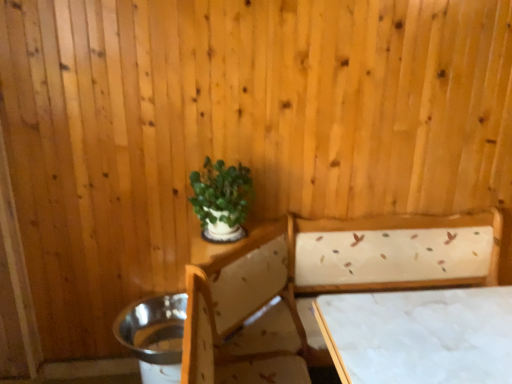
Question: Does white fabric-covered table at lower right come behind white fabric bed at center?

Choices:
 (A) yes
 (B) no

Answer: (A)

Question: From a real-world perspective, does white fabric-covered table at lower right sit lower than white fabric bed at center?

Choices:
 (A) no
 (B) yes

Answer: (A)

Question: Is white fabric-covered table at lower right completely or partially outside of white fabric bed at center?

Choices:
 (A) no
 (B) yes

Answer: (A)

Question: Considering the relative sizes of white fabric-covered table at lower right and white fabric bed at center in the image provided, is white fabric-covered table at lower right shorter than white fabric bed at center?

Choices:
 (A) no
 (B) yes

Answer: (B)

Question: Is white fabric-covered table at lower right to the right of white fabric bed at center from the viewer's perspective?

Choices:
 (A) yes
 (B) no

Answer: (A)

Question: Is white fabric-covered table at lower right in front of white fabric bed at center?

Choices:
 (A) yes
 (B) no

Answer: (B)

Question: Does white fabric bed at center appear on the right side of white fabric-covered table at lower right?

Choices:
 (A) yes
 (B) no

Answer: (B)

Question: From the image's perspective, is white fabric bed at center beneath white fabric-covered table at lower right?

Choices:
 (A) no
 (B) yes

Answer: (B)

Question: Does white fabric bed at center have a lesser width compared to white fabric-covered table at lower right?

Choices:
 (A) yes
 (B) no

Answer: (B)

Question: Does white fabric bed at center lie behind white fabric-covered table at lower right?

Choices:
 (A) yes
 (B) no

Answer: (B)

Question: From a real-world perspective, is white fabric bed at center on white fabric-covered table at lower right?

Choices:
 (A) no
 (B) yes

Answer: (A)

Question: Considering the relative sizes of white fabric bed at center and white fabric-covered table at lower right in the image provided, is white fabric bed at center wider than white fabric-covered table at lower right?

Choices:
 (A) no
 (B) yes

Answer: (B)

Question: Is white fabric-covered table at lower right facing towards green matte plant at upper center?

Choices:
 (A) no
 (B) yes

Answer: (A)